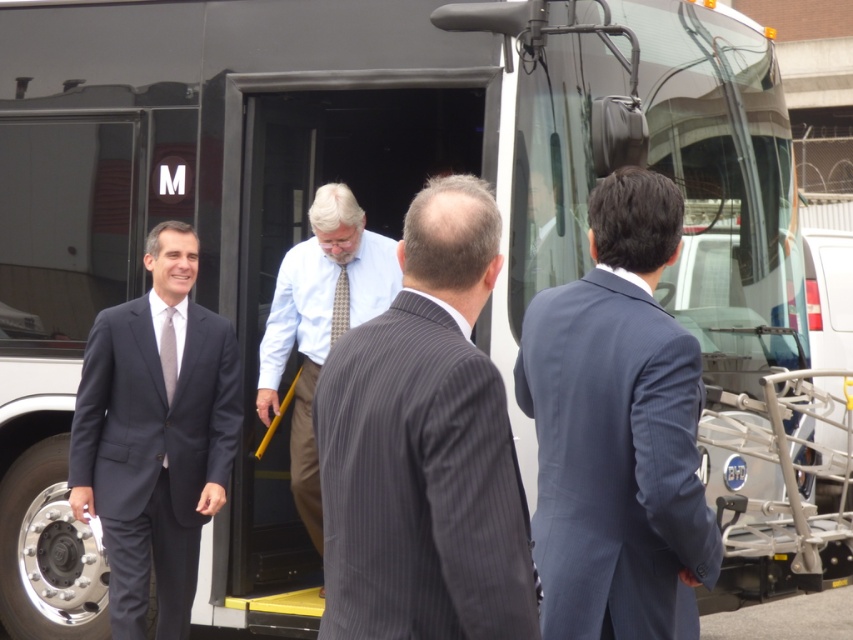
Who is positioned more to the left, blue pinstripe suit at center or checkered fabric tie at center?

checkered fabric tie at center

Is blue pinstripe suit at center wider than checkered fabric tie at center?

Answer: Indeed, blue pinstripe suit at center has a greater width compared to checkered fabric tie at center.

At what (x,y) coordinates should I click in order to perform the action: click on blue pinstripe suit at center. Please return your answer as a coordinate pair (x, y). Looking at the image, I should click on (618, 429).

At what (x,y) coordinates should I click in order to perform the action: click on dark blue suit at left. Please return your answer as a coordinate pair (x, y). The height and width of the screenshot is (640, 853). Looking at the image, I should click on (155, 436).

Is point (180, 326) farther from viewer compared to point (161, 364)?

That is True.

Image resolution: width=853 pixels, height=640 pixels. I want to click on dark blue suit at left, so click(x=155, y=436).

In the scene shown: Between dark blue suit at center and matte silver tie at left, which one appears on the right side from the viewer's perspective?

Positioned to the right is dark blue suit at center.

Does dark blue suit at center appear over matte silver tie at left?

Correct, dark blue suit at center is located above matte silver tie at left.

Which is behind, point (527, 196) or point (173, 355)?

Positioned behind is point (173, 355).

Where is `dark blue suit at center`? The height and width of the screenshot is (640, 853). dark blue suit at center is located at coordinates (556, 227).